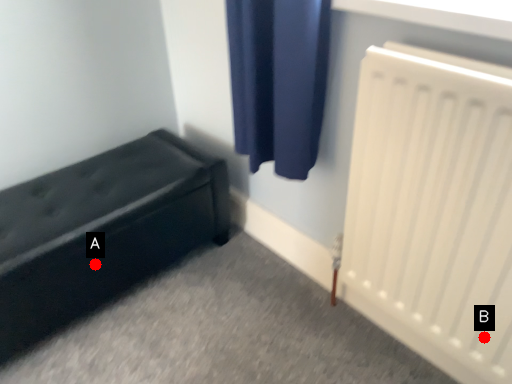
Question: Two points are circled on the image, labeled by A and B beside each circle. Which point appears closest to the camera in this image?

Choices:
 (A) A is closer
 (B) B is closer

Answer: (B)